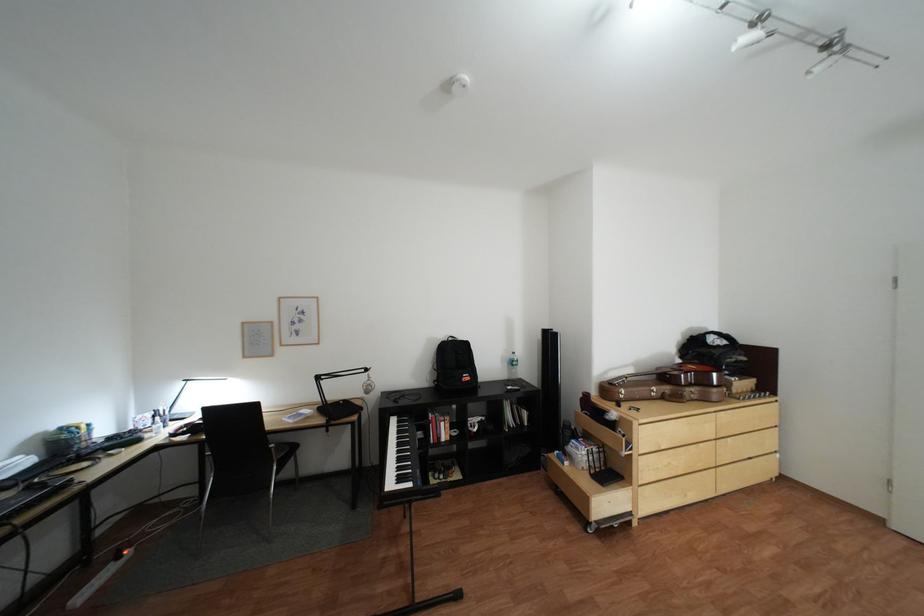
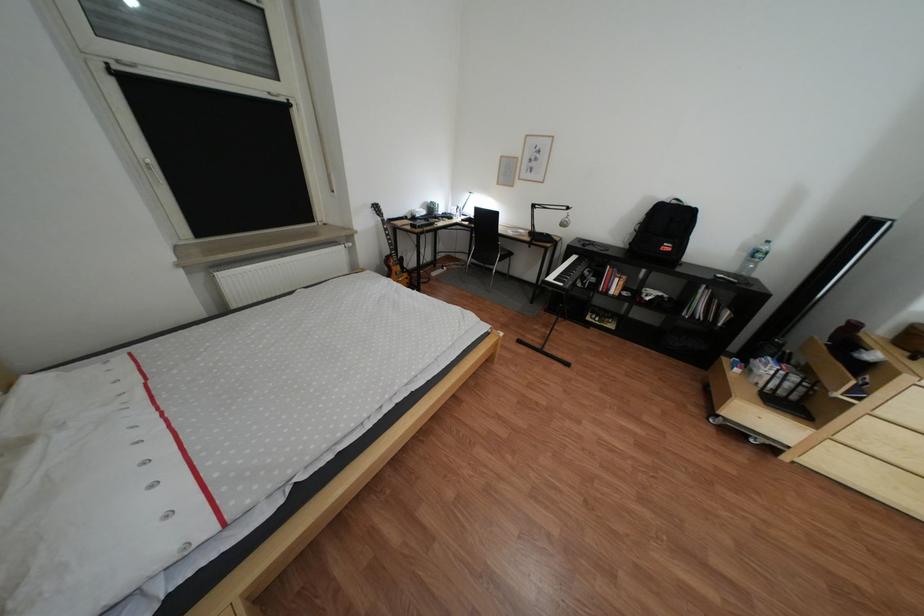
In the second image, find the point that corresponds to (521,365) in the first image.

(760, 256)